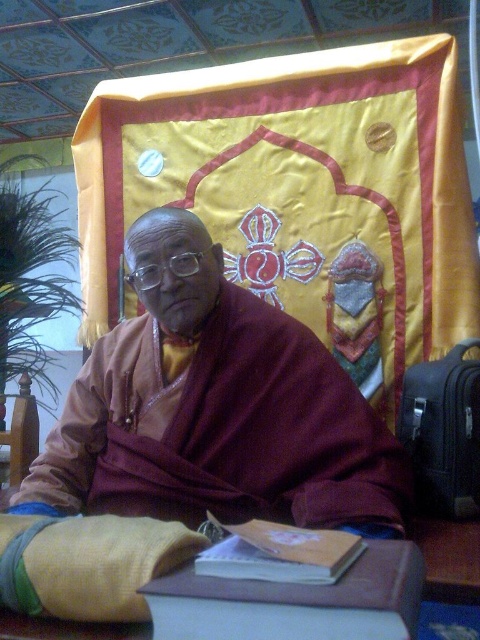
Identify the location of brown leather table at center. (296, 602).

Identify the location of brown leather table at center. The height and width of the screenshot is (640, 480). (296, 602).

Can you confirm if maroon woolen robe at center is positioned above brown leather table at center?

Yes, maroon woolen robe at center is above brown leather table at center.

In the scene shown: Does maroon woolen robe at center come in front of brown leather table at center?

That is False.

The image size is (480, 640). I want to click on maroon woolen robe at center, so click(215, 408).

Does maroon woolen robe at center have a smaller size compared to matte brown book at center?

Actually, maroon woolen robe at center might be larger than matte brown book at center.

Which is in front, point (132, 497) or point (310, 552)?

Point (310, 552) is more forward.

Which is in front, point (63, 429) or point (248, 536)?

Point (248, 536) is more forward.

This screenshot has width=480, height=640. I want to click on maroon woolen robe at center, so click(215, 408).